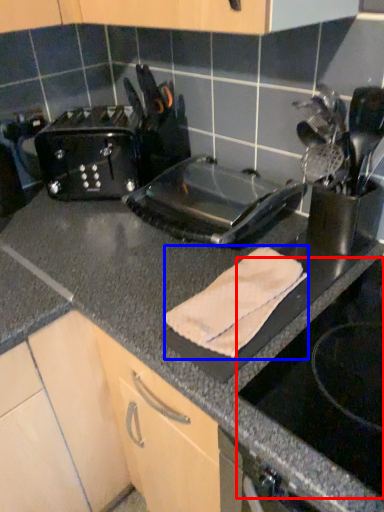
Question: Among these objects, which one is nearest to the camera, gas stove (highlighted by a red box) or bath towel (highlighted by a blue box)?

Choices:
 (A) gas stove
 (B) bath towel

Answer: (A)